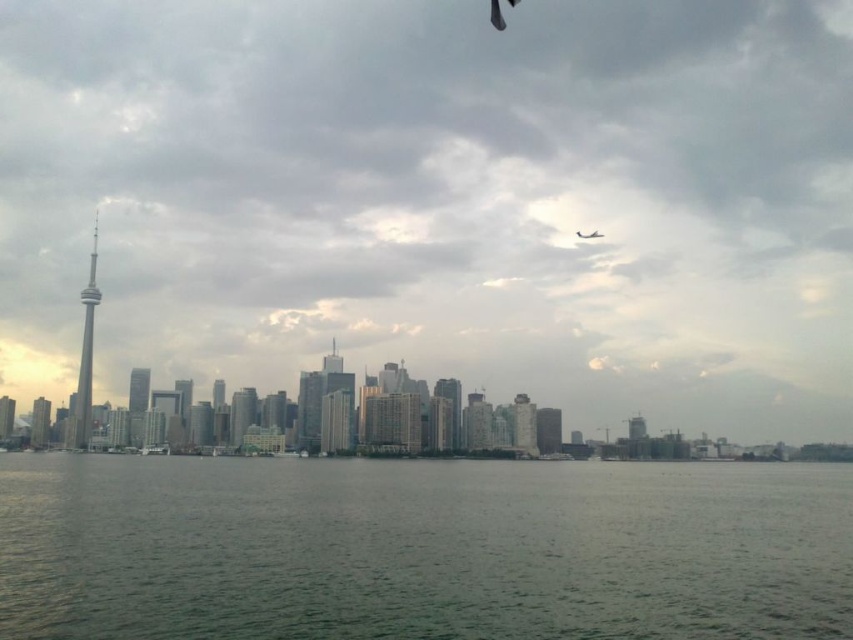
Question: Does gray-green water at center appear over white matte airplane at upper center?

Choices:
 (A) yes
 (B) no

Answer: (B)

Question: Does gray-green water at center appear on the right side of white matte airplane at upper center?

Choices:
 (A) yes
 (B) no

Answer: (B)

Question: Which of the following is the farthest from the observer?

Choices:
 (A) gray-green water at center
 (B) white matte airplane at upper center

Answer: (B)

Question: Among these objects, which one is nearest to the camera?

Choices:
 (A) gray-green water at center
 (B) white matte airplane at upper center

Answer: (A)

Question: Is gray-green water at center smaller than white matte airplane at upper center?

Choices:
 (A) yes
 (B) no

Answer: (B)